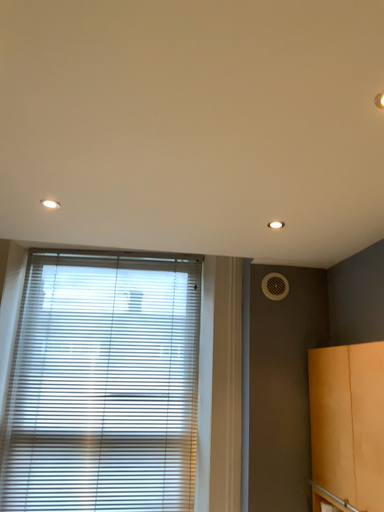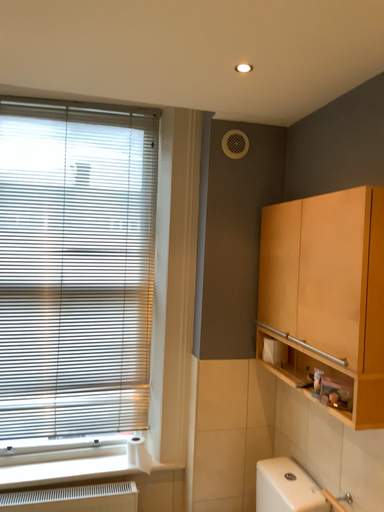
Question: Which way did the camera rotate in the video?

Choices:
 (A) rotated left
 (B) rotated right

Answer: (B)